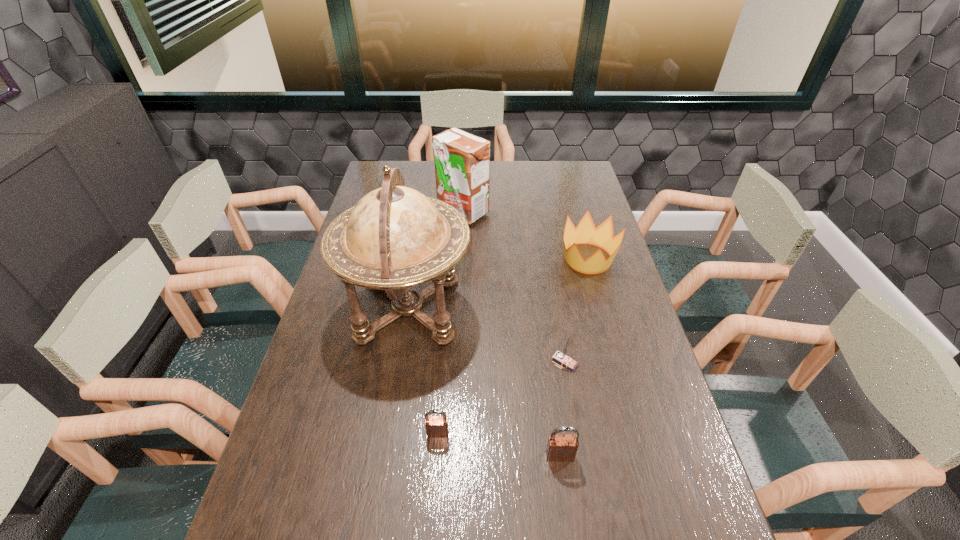
This screenshot has height=540, width=960. In the image, there is a desktop. In order to click on vacant region at the right edge in this screenshot , I will do `click(630, 467)`.

Find the location of a particular element. vacant region at the near left corner of the desktop is located at coordinates (303, 501).

Identify the location of vacant area at the near right corner. This screenshot has height=540, width=960. (682, 494).

At what (x,y) coordinates should I click in order to perform the action: click on free space between the farthest object and the crown. Please return your answer as a coordinate pair (x, y). The image size is (960, 540). Looking at the image, I should click on (525, 235).

This screenshot has width=960, height=540. In order to click on free space between the crown and the matchbox in this screenshot , I will do `click(576, 310)`.

The height and width of the screenshot is (540, 960). I want to click on vacant area that lies between the globe and the nearer padlock, so click(x=484, y=382).

Where is `free spot between the crown and the matchbox`? The image size is (960, 540). free spot between the crown and the matchbox is located at coordinates (576, 310).

Identify the location of unoccupied area between the crown and the shorter padlock. The image size is (960, 540). (513, 346).

The width and height of the screenshot is (960, 540). In order to click on vacant space in between the crown and the globe in this screenshot , I will do `click(497, 284)`.

Identify the location of free point between the crown and the matchbox. The width and height of the screenshot is (960, 540). (576, 310).